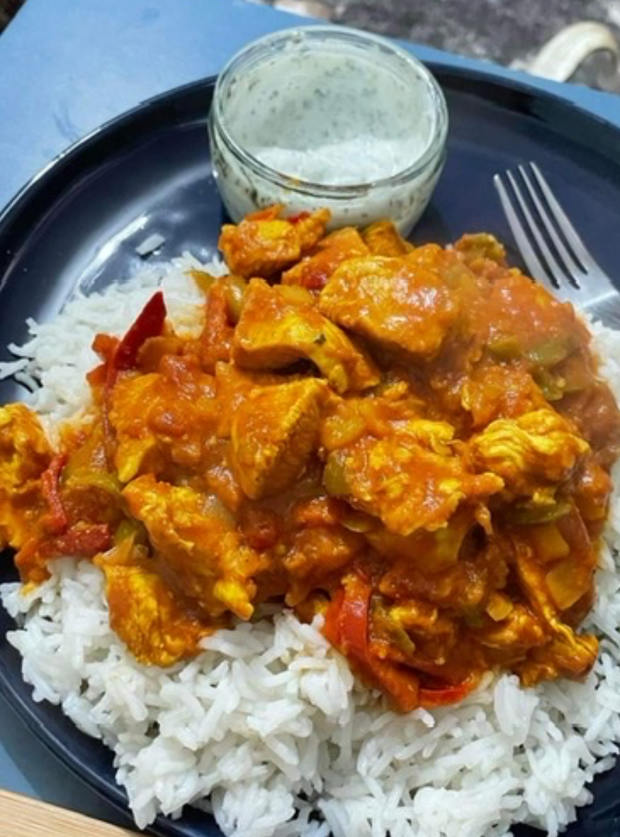
This screenshot has width=620, height=837. In order to click on fork in this screenshot , I will do `click(604, 295)`.